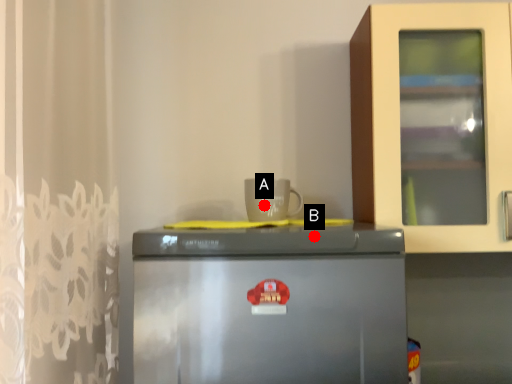
Question: Two points are circled on the image, labeled by A and B beside each circle. Among these points, which one is nearest to the camera?

Choices:
 (A) A is closer
 (B) B is closer

Answer: (B)